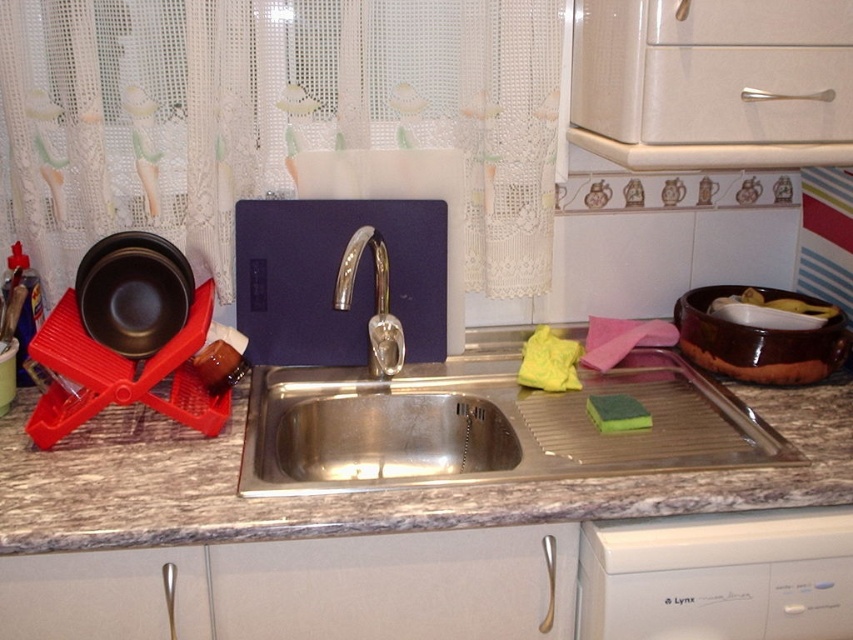
Question: Does stainless steel sink at center have a larger size compared to white plastic dishwasher at lower right?

Choices:
 (A) no
 (B) yes

Answer: (B)

Question: Which object is farther from the camera taking this photo?

Choices:
 (A) yellow sponge at sink
 (B) granite countertop at center
 (C) green sponge at sink
 (D) white plastic dishwasher at lower right

Answer: (A)

Question: Is white lace curtain at upper left wider than yellow sponge at sink?

Choices:
 (A) yes
 (B) no

Answer: (A)

Question: Among these objects, which one is farthest from the camera?

Choices:
 (A) yellow sponge at sink
 (B) green sponge at sink
 (C) white lace curtain at upper left
 (D) polished chrome faucet at center

Answer: (A)

Question: Can you confirm if stainless steel sink at center is positioned above white plastic dishwasher at lower right?

Choices:
 (A) yes
 (B) no

Answer: (A)

Question: Which object is positioned closest to the white lace curtain at upper left?

Choices:
 (A) green sponge at sink
 (B) white plastic dishwasher at lower right

Answer: (A)